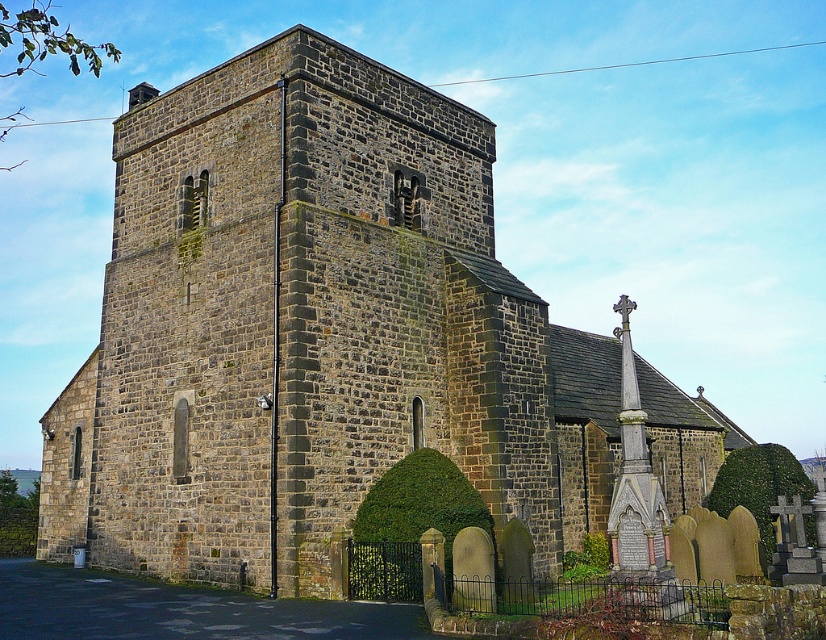
Question: Which point is closer to the camera?

Choices:
 (A) green leafy hedge at lower right
 (B) green leafy hedge at lower left
 (C) green leafy hedge at lower center

Answer: (C)

Question: Considering the relative positions of green leafy hedge at lower center and green leafy hedge at lower right in the image provided, where is green leafy hedge at lower center located with respect to green leafy hedge at lower right?

Choices:
 (A) above
 (B) below

Answer: (A)

Question: Where is green leafy hedge at lower right located in relation to green leafy hedge at lower left in the image?

Choices:
 (A) above
 (B) below

Answer: (A)

Question: Which point is farther from the camera taking this photo?

Choices:
 (A) (710, 504)
 (B) (413, 472)

Answer: (A)

Question: Which point is closer to the camera?

Choices:
 (A) green leafy hedge at lower center
 (B) green leafy hedge at lower left

Answer: (A)

Question: Can you confirm if green leafy hedge at lower right is positioned below green leafy hedge at lower left?

Choices:
 (A) yes
 (B) no

Answer: (B)